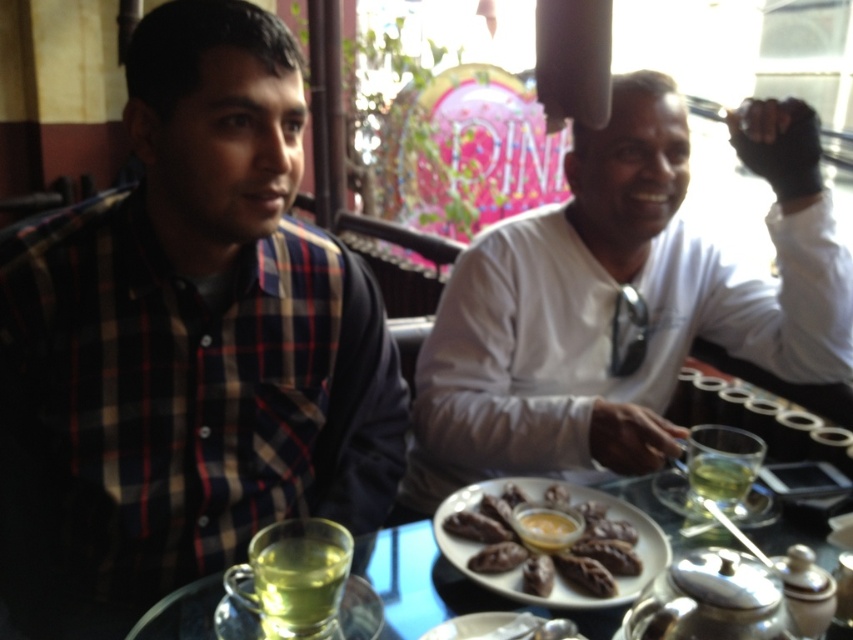
You are a server at the cafe and need to place a new order of cookies on the table between the clear glass plate at center and the green glass at center. The cookies require 10 inches of space to fit. Can you fit them between these two items?

The clear glass plate at center is 8.93 inches from the green glass at center. Since the cookies require 10 inches of space, which is more than the available distance, they cannot fit between these two items.